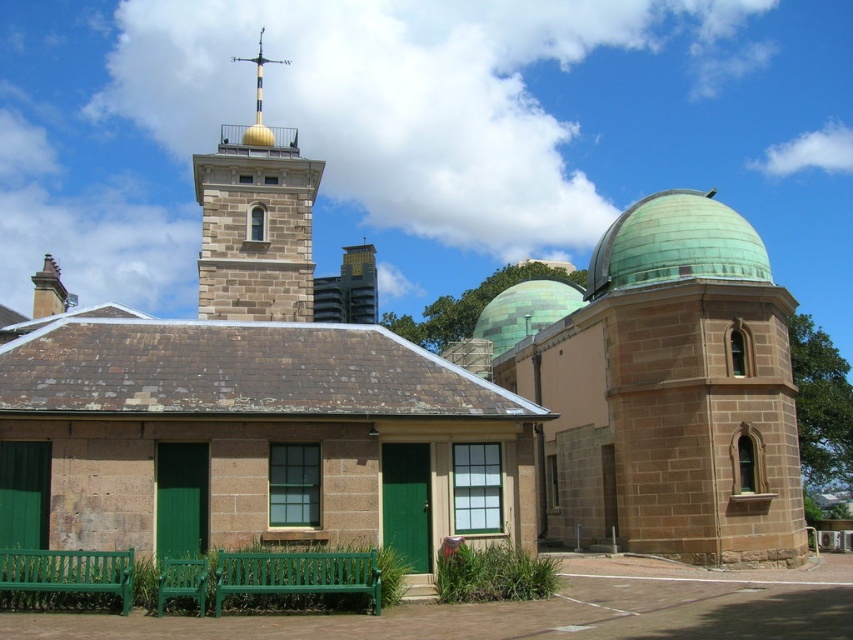
You are an architect analyzing the historic building complex. You notice the green stone dome at upper right and the gold polished metal spire at upper center. Which of these two structures is shorter?

The green stone dome at upper right is not as tall as the gold polished metal spire at upper center, so the green stone dome at upper right is shorter.

You are standing at the entrance of the historic building complex and want to sit on the green wooden bench at lower center. According to the coordinates provided, where exactly is the bench positioned relative to the building?

The green wooden bench at lower center is located at point [297,573], which means it is positioned to the right and slightly above the lower center area relative to the building.

You are standing in front of the historic building complex and want to take a photo that includes both point (288, 592) and point (258, 56). Which point should you focus on first to ensure both are in focus?

You should focus on point (258, 56) first because it is further away from the camera than point (288, 592). This way, the depth of field will likely include both points when focusing on the farther one.